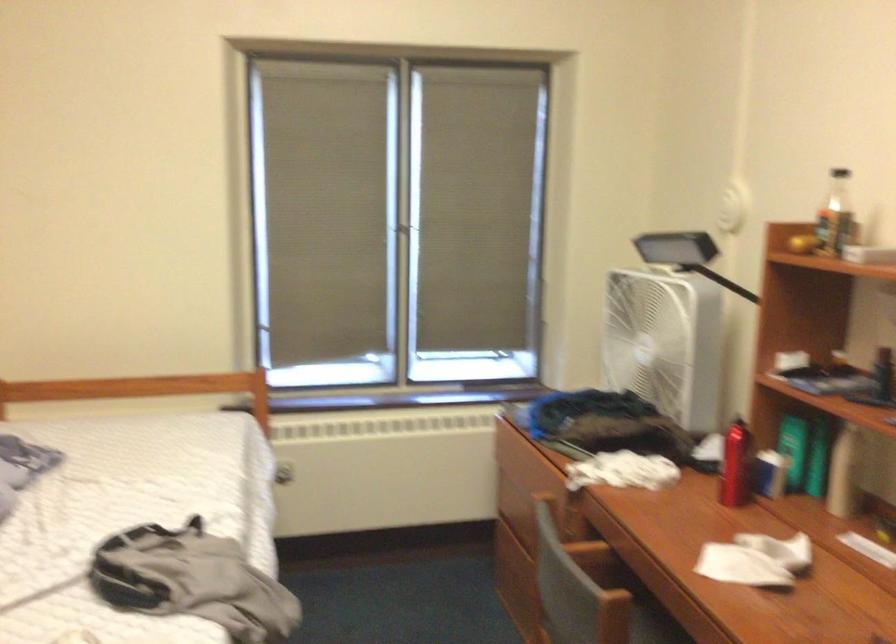
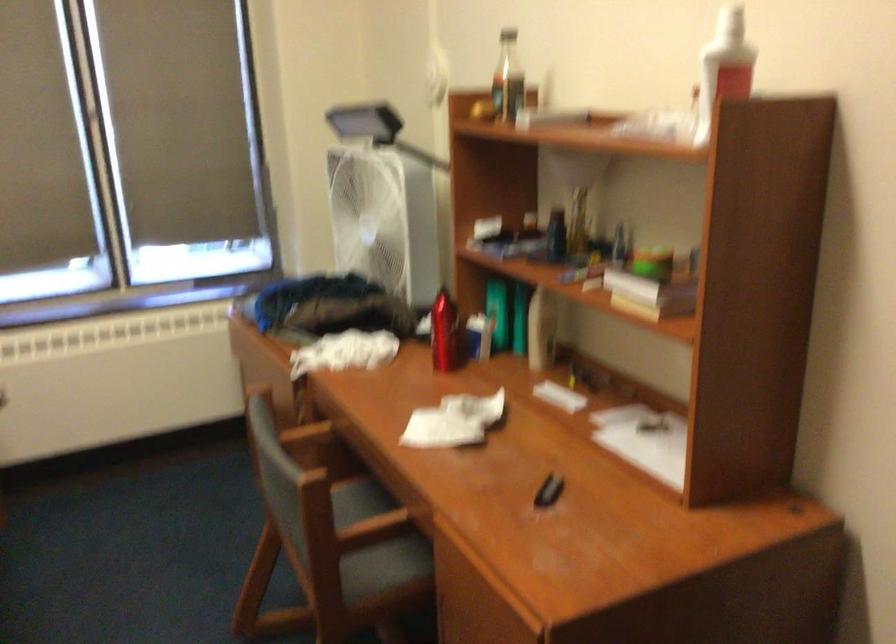
Question: The images are taken continuously from a first-person perspective. In which direction is your viewpoint rotating?

Choices:
 (A) Left
 (B) Right
 (C) Up
 (D) Down

Answer: (B)